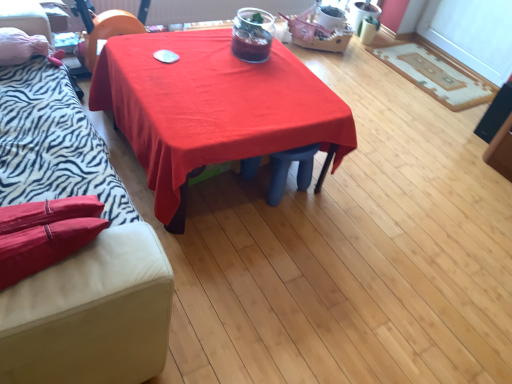
Question: Considering the relative sizes of zebra print fabric couch at left and red fabric table at center in the image provided, is zebra print fabric couch at left shorter than red fabric table at center?

Choices:
 (A) yes
 (B) no

Answer: (B)

Question: Is zebra print fabric couch at left facing towards red fabric table at center?

Choices:
 (A) no
 (B) yes

Answer: (B)

Question: Does zebra print fabric couch at left have a smaller size compared to red fabric table at center?

Choices:
 (A) no
 (B) yes

Answer: (A)

Question: Is the position of zebra print fabric couch at left less distant than that of red fabric table at center?

Choices:
 (A) yes
 (B) no

Answer: (A)

Question: Are zebra print fabric couch at left and red fabric table at center far apart?

Choices:
 (A) yes
 (B) no

Answer: (B)

Question: Is zebra print fabric couch at left bigger than red fabric table at center?

Choices:
 (A) no
 (B) yes

Answer: (B)

Question: From the image's perspective, would you say beige textured rug at right is shown under zebra print fabric couch at left?

Choices:
 (A) yes
 (B) no

Answer: (B)

Question: Is beige textured rug at right further to camera compared to zebra print fabric couch at left?

Choices:
 (A) yes
 (B) no

Answer: (A)

Question: Considering the relative positions of beige textured rug at right and zebra print fabric couch at left in the image provided, is beige textured rug at right to the left of zebra print fabric couch at left from the viewer's perspective?

Choices:
 (A) yes
 (B) no

Answer: (B)

Question: Can you confirm if beige textured rug at right is thinner than zebra print fabric couch at left?

Choices:
 (A) no
 (B) yes

Answer: (A)

Question: From the image's perspective, would you say beige textured rug at right is positioned over zebra print fabric couch at left?

Choices:
 (A) yes
 (B) no

Answer: (A)

Question: Is beige textured rug at right far away from zebra print fabric couch at left?

Choices:
 (A) no
 (B) yes

Answer: (B)

Question: Are beige textured rug at right and red fabric table at center making contact?

Choices:
 (A) no
 (B) yes

Answer: (A)